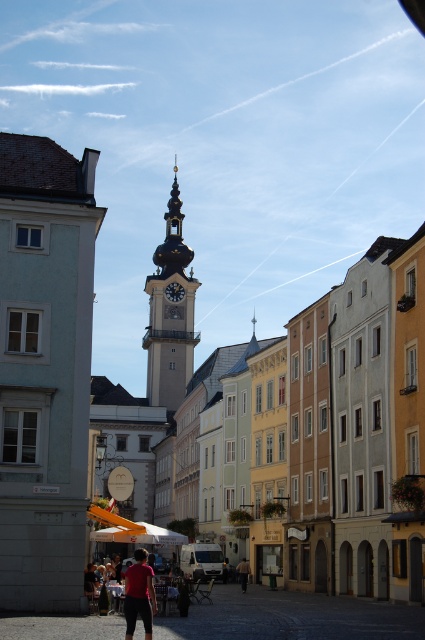
Question: Which is farther from the polished gold clock tower at center?

Choices:
 (A) gold metallic clock at center
 (B) light brown leather jacket at center
 (C) matte black pants at center

Answer: (C)

Question: Which object is positioned closest to the polished gold clock tower at center?

Choices:
 (A) gold metallic clock at center
 (B) matte black pants at center
 (C) light brown leather jacket at center

Answer: (A)

Question: Which point is farther to the camera?

Choices:
 (A) gold metallic clock at center
 (B) light brown leather jacket at center

Answer: (A)

Question: Can you confirm if matte black pants at center is wider than gold metallic clock at center?

Choices:
 (A) no
 (B) yes

Answer: (B)

Question: Does gold metallic clock at center have a larger size compared to light brown leather jacket at center?

Choices:
 (A) no
 (B) yes

Answer: (A)

Question: Does polished gold clock tower at center have a smaller size compared to gold metallic clock at center?

Choices:
 (A) no
 (B) yes

Answer: (A)